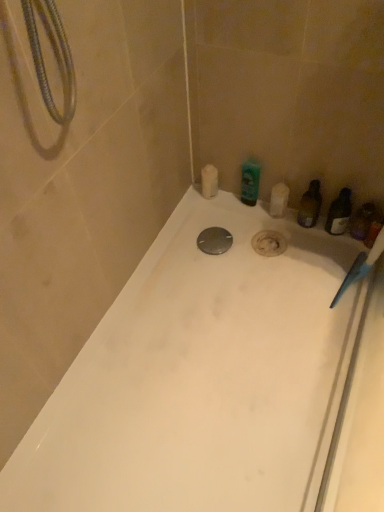
Locate an element on the screen. white matte soap bar at upper center, the fourth toiletry positioned from the right is located at coordinates (209, 181).

The image size is (384, 512). What do you see at coordinates (362, 221) in the screenshot?
I see `translucent plastic bottle at right, positioned as the 4th toiletry in left-to-right order` at bounding box center [362, 221].

At what (x,y) coordinates should I click in order to perform the action: click on translucent plastic bottle at right, arranged as the third toiletry when viewed from the left. Please return your answer as a coordinate pair (x, y). This screenshot has height=512, width=384. Looking at the image, I should click on (310, 205).

Is white glossy bathtub at center positioned beyond the bounds of translucent plastic bottle at right, placed as the 1th toiletry when sorted from right to left?

white glossy bathtub at center is positioned outside translucent plastic bottle at right, placed as the 1th toiletry when sorted from right to left.

Is white glossy bathtub at center looking in the opposite direction of translucent plastic bottle at right, positioned as the 4th toiletry in left-to-right order?

That's not correct — white glossy bathtub at center is not looking away from translucent plastic bottle at right, positioned as the 4th toiletry in left-to-right order.

From the image's perspective, relative to translucent plastic bottle at right, positioned as the 4th toiletry in left-to-right order, is white glossy bathtub at center above or below?

From the image's perspective, white glossy bathtub at center appears below translucent plastic bottle at right, positioned as the 4th toiletry in left-to-right order.

Is white glossy bathtub at center directly adjacent to translucent plastic bottle at right, positioned as the 4th toiletry in left-to-right order?

white glossy bathtub at center and translucent plastic bottle at right, positioned as the 4th toiletry in left-to-right order, are clearly separated.

From a real-world perspective, is green glossy bottle at upper right, the second toiletry viewed from the left, over white glossy bathtub at center?

Yes, from a real-world perspective, green glossy bottle at upper right, the second toiletry viewed from the left, is above white glossy bathtub at center.

Based on the photo, which object is further away from the camera, green glossy bottle at upper right, acting as the 3th toiletry starting from the right, or white glossy bathtub at center?

green glossy bottle at upper right, acting as the 3th toiletry starting from the right.

How different are the orientations of green glossy bottle at upper right, acting as the 3th toiletry starting from the right, and white glossy bathtub at center in degrees?

88.6 degrees.

Is green glossy bottle at upper right, acting as the 3th toiletry starting from the right, facing towards white glossy bathtub at center?

Yes, green glossy bottle at upper right, acting as the 3th toiletry starting from the right, is facing white glossy bathtub at center.

Which object is closer to the camera taking this photo, translucent plastic bottle at right, placed as the 1th toiletry when sorted from right to left, or metallic silver drain at center?

translucent plastic bottle at right, placed as the 1th toiletry when sorted from right to left.

Is translucent plastic bottle at right, placed as the 1th toiletry when sorted from right to left, touching metallic silver drain at center?

No, translucent plastic bottle at right, placed as the 1th toiletry when sorted from right to left, is not with metallic silver drain at center.

Does translucent plastic bottle at right, positioned as the 4th toiletry in left-to-right order, turn towards metallic silver drain at center?

No, translucent plastic bottle at right, positioned as the 4th toiletry in left-to-right order, does not turn towards metallic silver drain at center.

The height and width of the screenshot is (512, 384). In order to click on drain below the translucent plastic bottle at right, placed as the 1th toiletry when sorted from right to left (from the image's perspective) in this screenshot , I will do `click(214, 241)`.

Is green glossy bottle at upper right, acting as the 3th toiletry starting from the right, surrounded by metallic silver drain at center?

No, green glossy bottle at upper right, acting as the 3th toiletry starting from the right, is not inside metallic silver drain at center.

Considering their positions, is metallic silver drain at center located in front of or behind green glossy bottle at upper right, acting as the 3th toiletry starting from the right?

In the image, metallic silver drain at center appears behind green glossy bottle at upper right, acting as the 3th toiletry starting from the right.

Is point (226, 249) farther from camera compared to point (248, 190)?

No, it is in front of (248, 190).

From a real-world perspective, between metallic silver drain at center and green glossy bottle at upper right, acting as the 3th toiletry starting from the right, who is vertically lower?

metallic silver drain at center, from a real-world perspective.

From a real-world perspective, between white matte soap bar at upper center, which appears as the first toiletry when viewed from the left, and translucent plastic bottle at right, arranged as the third toiletry when viewed from the left, who is vertically lower?

In real-world perspective, white matte soap bar at upper center, which appears as the first toiletry when viewed from the left, is lower.

How many degrees apart are the facing directions of white matte soap bar at upper center, the fourth toiletry positioned from the right, and translucent plastic bottle at right, arranged as the third toiletry when viewed from the left?

white matte soap bar at upper center, the fourth toiletry positioned from the right, and translucent plastic bottle at right, arranged as the third toiletry when viewed from the left, are facing 1.05 degrees away from each other.

Is white matte soap bar at upper center, the fourth toiletry positioned from the right, wider or thinner than translucent plastic bottle at right, marked as the second toiletry in a right-to-left arrangement?

Considering their sizes, white matte soap bar at upper center, the fourth toiletry positioned from the right, looks slimmer than translucent plastic bottle at right, marked as the second toiletry in a right-to-left arrangement.

Consider the image. Is translucent plastic bottle at right, arranged as the third toiletry when viewed from the left, at the back of white matte soap bar at upper center, the fourth toiletry positioned from the right?

No, white matte soap bar at upper center, the fourth toiletry positioned from the right, is not facing the opposite direction of translucent plastic bottle at right, arranged as the third toiletry when viewed from the left.

Which is behind, point (214, 230) or point (313, 221)?

The point (214, 230) is more distant.

From the image's perspective, does metallic silver drain at center appear lower than translucent plastic bottle at right, arranged as the third toiletry when viewed from the left?

Yes.

From the picture: Between metallic silver drain at center and translucent plastic bottle at right, marked as the second toiletry in a right-to-left arrangement, which one has larger size?

With larger size is translucent plastic bottle at right, marked as the second toiletry in a right-to-left arrangement.

Image resolution: width=384 pixels, height=512 pixels. What are the coordinates of `drain below the translucent plastic bottle at right, marked as the second toiletry in a right-to-left arrangement (from the image's perspective)` in the screenshot? It's located at (214, 241).

From the picture: Are white glossy bathtub at center and metallic silver drain at center far apart?

No, white glossy bathtub at center is not far from metallic silver drain at center.

In the scene shown: From a real-world perspective, is white glossy bathtub at center positioned over metallic silver drain at center based on gravity?

Yes.

What's the angular difference between white glossy bathtub at center and metallic silver drain at center's facing directions?

white glossy bathtub at center and metallic silver drain at center are facing 88.6 degrees away from each other.

Locate an element on the screen. This screenshot has width=384, height=512. bathtub below the metallic silver drain at center (from the image's perspective) is located at coordinates (207, 378).

From the image's perspective, count 1st toiletrys upward from the white glossy bathtub at center and point to it. Please provide its 2D coordinates.

[(362, 221)]

Where is `bathtub that is on the left side of green glossy bottle at upper right, the second toiletry viewed from the left`? The height and width of the screenshot is (512, 384). bathtub that is on the left side of green glossy bottle at upper right, the second toiletry viewed from the left is located at coordinates (207, 378).

From the image, which object appears to be farther from green glossy bottle at upper right, the second toiletry viewed from the left, translucent plastic bottle at right, positioned as the 4th toiletry in left-to-right order, or metallic silver drain at center?

Among the two, translucent plastic bottle at right, positioned as the 4th toiletry in left-to-right order, is located further to green glossy bottle at upper right, the second toiletry viewed from the left.

Considering their positions, is green glossy bottle at upper right, acting as the 3th toiletry starting from the right, positioned further to translucent plastic bottle at right, arranged as the third toiletry when viewed from the left, than white matte soap bar at upper center, which appears as the first toiletry when viewed from the left?

white matte soap bar at upper center, which appears as the first toiletry when viewed from the left, is positioned further to the anchor translucent plastic bottle at right, arranged as the third toiletry when viewed from the left.

Looking at the image, which one is located further to metallic silver drain at center, green glossy bottle at upper right, the second toiletry viewed from the left, or white matte soap bar at upper center, the fourth toiletry positioned from the right?

green glossy bottle at upper right, the second toiletry viewed from the left, lies further to metallic silver drain at center than the other object.

Estimate the real-world distances between objects in this image. Which object is closer to translucent plastic bottle at right, marked as the second toiletry in a right-to-left arrangement, white matte soap bar at upper center, the fourth toiletry positioned from the right, or white glossy bathtub at center?

Based on the image, white matte soap bar at upper center, the fourth toiletry positioned from the right, appears to be nearer to translucent plastic bottle at right, marked as the second toiletry in a right-to-left arrangement.

From the image, which object appears to be nearer to translucent plastic bottle at right, arranged as the third toiletry when viewed from the left, green glossy bottle at upper right, the second toiletry viewed from the left, or metallic silver drain at center?

green glossy bottle at upper right, the second toiletry viewed from the left, is positioned closer to the anchor translucent plastic bottle at right, arranged as the third toiletry when viewed from the left.

Based on their spatial positions, is white glossy bathtub at center or translucent plastic bottle at right, arranged as the third toiletry when viewed from the left, closer to metallic silver drain at center?

translucent plastic bottle at right, arranged as the third toiletry when viewed from the left, lies closer to metallic silver drain at center than the other object.

Based on their spatial positions, is metallic silver drain at center or translucent plastic bottle at right, positioned as the 4th toiletry in left-to-right order, closer to translucent plastic bottle at right, marked as the second toiletry in a right-to-left arrangement?

Based on the image, translucent plastic bottle at right, positioned as the 4th toiletry in left-to-right order, appears to be nearer to translucent plastic bottle at right, marked as the second toiletry in a right-to-left arrangement.

Which object lies nearer to the anchor point translucent plastic bottle at right, arranged as the third toiletry when viewed from the left, white matte soap bar at upper center, which appears as the first toiletry when viewed from the left, or metallic silver drain at center?

metallic silver drain at center is positioned closer to the anchor translucent plastic bottle at right, arranged as the third toiletry when viewed from the left.

The height and width of the screenshot is (512, 384). Find the location of `toiletry between white glossy bathtub at center and translucent plastic bottle at right, arranged as the third toiletry when viewed from the left, in the front-back direction`. toiletry between white glossy bathtub at center and translucent plastic bottle at right, arranged as the third toiletry when viewed from the left, in the front-back direction is located at coordinates (362, 221).

This screenshot has width=384, height=512. What are the coordinates of `drain between white glossy bathtub at center and white matte soap bar at upper center, which appears as the first toiletry when viewed from the left, from front to back` in the screenshot? It's located at (214, 241).

Locate an element on the screen. The image size is (384, 512). drain between white matte soap bar at upper center, which appears as the first toiletry when viewed from the left, and translucent plastic bottle at right, positioned as the 4th toiletry in left-to-right order is located at coordinates (214, 241).

Locate an element on the screen. This screenshot has height=512, width=384. toiletry located between white matte soap bar at upper center, the fourth toiletry positioned from the right, and translucent plastic bottle at right, arranged as the third toiletry when viewed from the left, in the left-right direction is located at coordinates (250, 181).